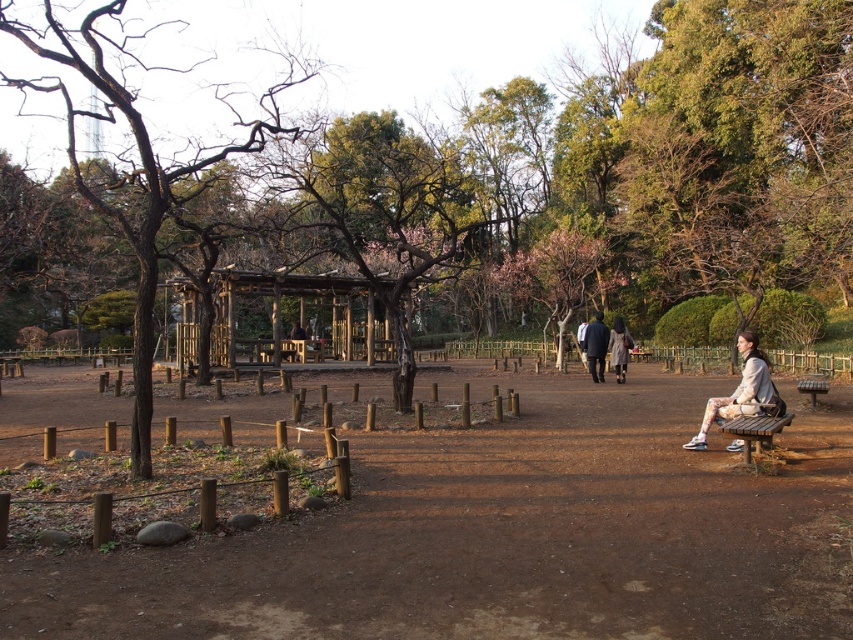
Question: Among these points, which one is nearest to the camera?

Choices:
 (A) (741, 355)
 (B) (292, 604)
 (C) (734, 420)
 (D) (599, 365)

Answer: (B)

Question: Which of these objects is positioned closest to the dark blue coat at center?

Choices:
 (A) light beige fabric jacket at lower right
 (B) light gray coat at center

Answer: (B)

Question: Can you confirm if wooden gazebo at center is positioned to the left of wooden park bench at lower right?

Choices:
 (A) no
 (B) yes

Answer: (B)

Question: Which object is closer to the camera taking this photo?

Choices:
 (A) wooden gazebo at center
 (B) brown dirt path at center
 (C) dark blue coat at center

Answer: (B)

Question: Is bare wood tree at left positioned behind light beige fabric jacket at lower right?

Choices:
 (A) no
 (B) yes

Answer: (A)

Question: Does brown dirt path at center lie behind wooden park bench at lower right?

Choices:
 (A) yes
 (B) no

Answer: (B)